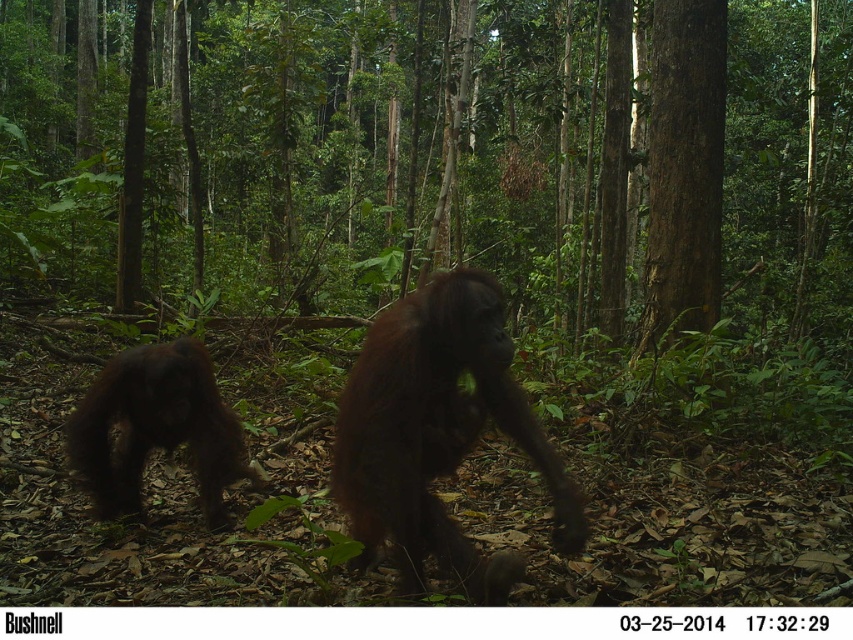
Question: Which object is positioned closest to the brown rough bark tree at right?

Choices:
 (A) brown furry orangutan at left
 (B) brown furry orangutan at center

Answer: (A)

Question: Can you confirm if brown rough bark tree at right is thinner than brown furry orangutan at left?

Choices:
 (A) no
 (B) yes

Answer: (A)

Question: Among these objects, which one is nearest to the camera?

Choices:
 (A) brown rough bark tree at right
 (B) brown furry orangutan at center
 (C) brown furry orangutan at left

Answer: (B)

Question: Which object is positioned farthest from the brown rough bark tree at right?

Choices:
 (A) brown furry orangutan at left
 (B) brown furry orangutan at center

Answer: (B)

Question: Observing the image, what is the correct spatial positioning of brown furry orangutan at center in reference to brown furry orangutan at left?

Choices:
 (A) right
 (B) left

Answer: (A)

Question: Can you confirm if brown furry orangutan at center is thinner than brown furry orangutan at left?

Choices:
 (A) no
 (B) yes

Answer: (A)